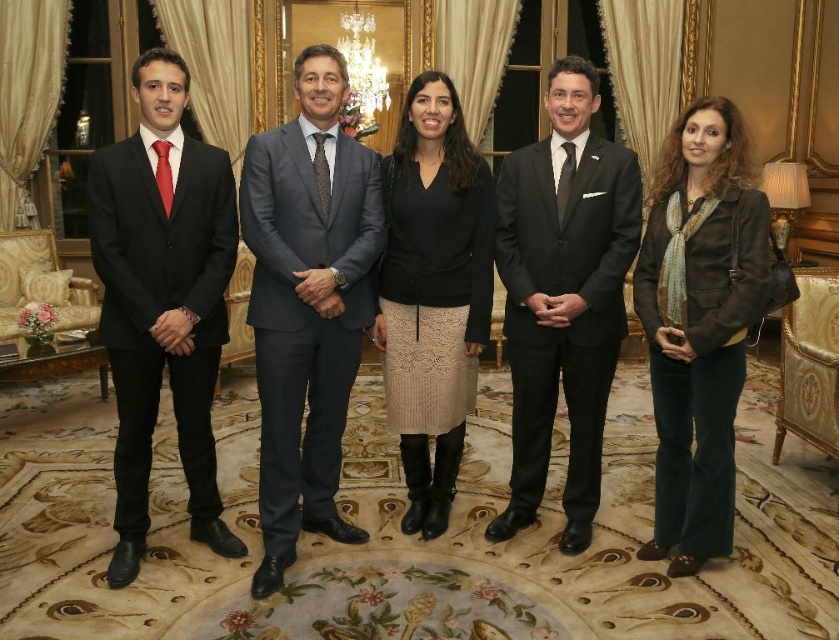
Question: Among these points, which one is farthest from the camera?

Choices:
 (A) pos(576,317)
 (B) pos(425,188)
 (C) pos(292,256)
 (D) pos(692,496)

Answer: (B)

Question: Is black satin suit at center below black lace skirt at center?

Choices:
 (A) yes
 (B) no

Answer: (B)

Question: Can you confirm if gray suit at center is wider than black lace skirt at center?

Choices:
 (A) yes
 (B) no

Answer: (A)

Question: Among these objects, which one is nearest to the camera?

Choices:
 (A) black lace skirt at center
 (B) gray suit at center

Answer: (B)

Question: Is gray suit at center positioned at the back of velvet brown jacket at center?

Choices:
 (A) no
 (B) yes

Answer: (B)

Question: Which of the following is the farthest from the observer?

Choices:
 (A) black satin suit at center
 (B) velvet brown jacket at center
 (C) gray suit at center

Answer: (A)